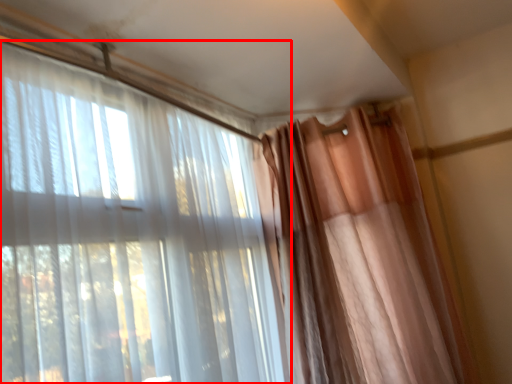
Question: From the image's perspective, what is the correct spatial positioning of curtain (annotated by the red box) in reference to curtain?

Choices:
 (A) below
 (B) above

Answer: (B)